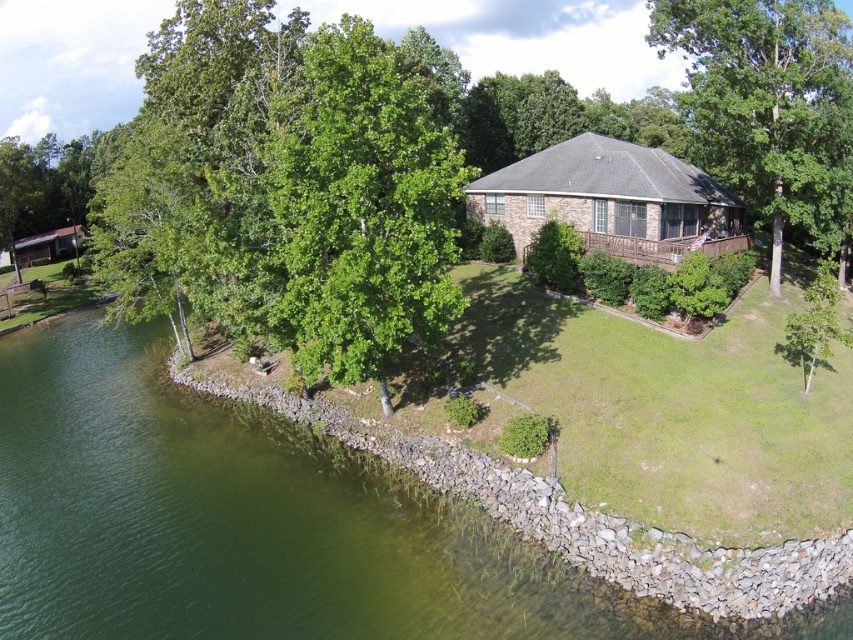
Question: Among these points, which one is nearest to the camera?

Choices:
 (A) (129, 588)
 (B) (711, 240)
 (C) (49, 237)
 (D) (785, 96)

Answer: (A)

Question: Which of these objects is positioned farthest from the matte brown cottage at lower left?

Choices:
 (A) green water at lower left
 (B) green leafy tree at upper right

Answer: (B)

Question: Estimate the real-world distances between objects in this image. Which object is closer to the matte brown cottage at lower left?

Choices:
 (A) brown brick cottage at center
 (B) green water at lower left
 (C) green leafy tree at upper right

Answer: (B)

Question: Does green water at lower left appear on the left side of brown brick cottage at center?

Choices:
 (A) no
 (B) yes

Answer: (B)

Question: Can you confirm if green water at lower left is bigger than matte brown cottage at lower left?

Choices:
 (A) yes
 (B) no

Answer: (A)

Question: Does green leafy tree at upper right have a greater width compared to brown brick cottage at center?

Choices:
 (A) yes
 (B) no

Answer: (B)